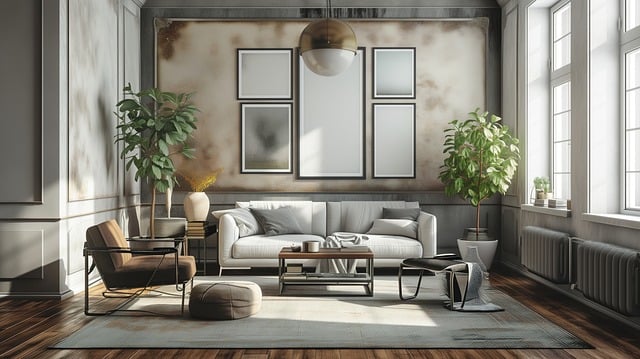
At what (x,y) coordinates should I click in order to perform the action: click on radiators. Please return your answer as a coordinate pair (x, y). Looking at the image, I should click on pos(608,278), pos(527,250).